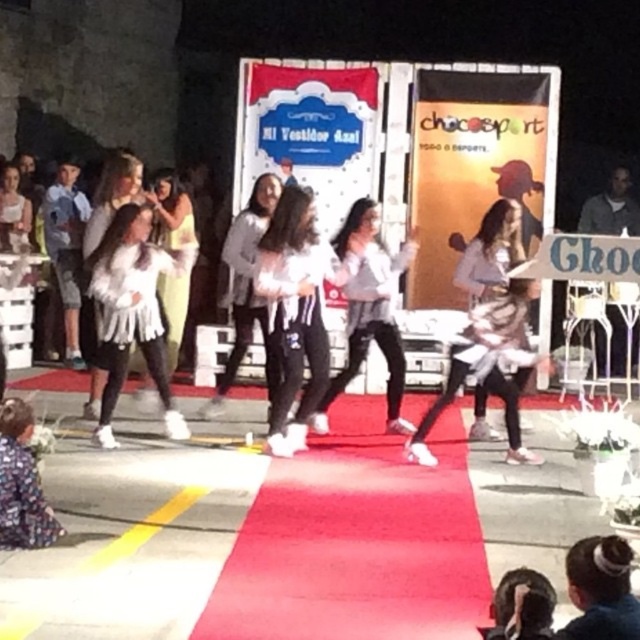
Is white fluffy dress at center smaller than white fluffy coat at center?

No.

Who is more distant from viewer, (161, 349) or (112, 173)?

Positioned behind is point (112, 173).

Who is more forward, (x=161, y=262) or (x=115, y=189)?

Point (x=161, y=262) is more forward.

The width and height of the screenshot is (640, 640). Find the location of `white fluffy dress at center`. white fluffy dress at center is located at coordinates (132, 310).

You are a GUI agent. You are given a task and a screenshot of the screen. Output one action in this format:
    pyautogui.click(x=<x>, y=<y>)
    Task: Click on the white matte pants at center
    
    Given the screenshot: What is the action you would take?
    pyautogui.click(x=296, y=310)

Can you confirm if white matte pants at center is bigger than white fluffy dress at center?

Incorrect, white matte pants at center is not larger than white fluffy dress at center.

Does point (289, 374) come in front of point (132, 225)?

No, it is behind (132, 225).

Locate an element on the screen. This screenshot has width=640, height=640. white matte pants at center is located at coordinates (296, 310).

What do you see at coordinates (296, 310) in the screenshot? I see `white matte pants at center` at bounding box center [296, 310].

Where is `white matte pants at center`? The height and width of the screenshot is (640, 640). white matte pants at center is located at coordinates (296, 310).